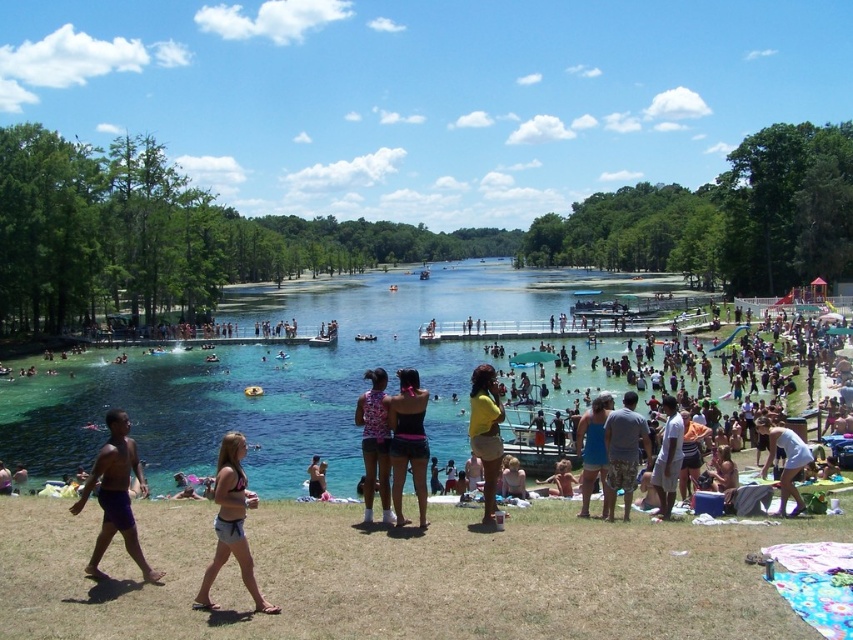
Question: Is yellow matte shorts at center to the left of matte pink bikini top at center from the viewer's perspective?

Choices:
 (A) no
 (B) yes

Answer: (A)

Question: Which of these objects is positioned closest to the black swimsuit at center?

Choices:
 (A) matte pink bikini top at center
 (B) white cotton tank top at lower right
 (C) beige denim shorts at lower center

Answer: (C)

Question: Which point is closer to the camera taking this photo?

Choices:
 (A) (242, 483)
 (B) (114, 452)
 (C) (590, 454)

Answer: (A)

Question: Which object appears closest to the camera in this image?

Choices:
 (A) blue fabric dress at center
 (B) pink printed tank top at center

Answer: (B)

Question: Is clear blue water at center to the right of pink printed tank top at center from the viewer's perspective?

Choices:
 (A) no
 (B) yes

Answer: (B)

Question: Can you confirm if beige denim shorts at lower center is bigger than yellow matte shorts at center?

Choices:
 (A) no
 (B) yes

Answer: (B)